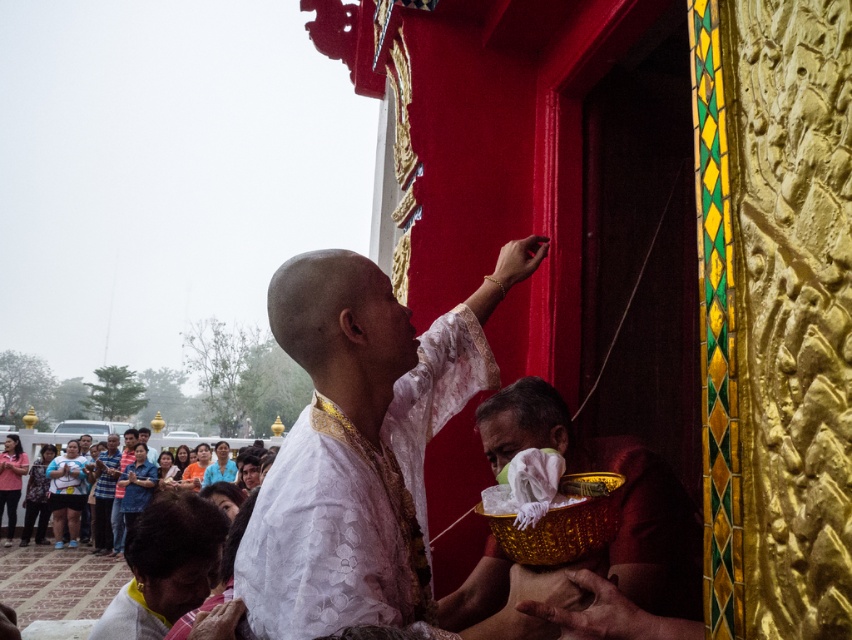
Is white lace cloth at center bigger than blue fabric shirt at lower left?

Actually, white lace cloth at center might be smaller than blue fabric shirt at lower left.

Between point (360, 362) and point (223, 444), which one is positioned in front?

Positioned in front is point (360, 362).

The image size is (852, 640). I want to click on white lace cloth at center, so click(360, 440).

Does white matte shirt at center have a smaller size compared to blue fabric shirt at lower left?

Yes, white matte shirt at center is smaller than blue fabric shirt at lower left.

Can you confirm if white matte shirt at center is positioned to the left of blue fabric shirt at lower left?

No, white matte shirt at center is not to the left of blue fabric shirt at lower left.

Which is behind, point (133, 524) or point (217, 452)?

Point (217, 452)

The width and height of the screenshot is (852, 640). I want to click on white matte shirt at center, so click(165, 566).

Between matte white shirt at center and blue fabric shirt at lower left, which one has more height?

matte white shirt at center

Is point (117, 444) positioned before point (209, 468)?

No.

You are a GUI agent. You are given a task and a screenshot of the screen. Output one action in this format:
    pyautogui.click(x=<x>, y=<y>)
    Task: Click on the matte white shirt at center
    The height and width of the screenshot is (640, 852).
    Given the screenshot: What is the action you would take?
    pyautogui.click(x=104, y=493)